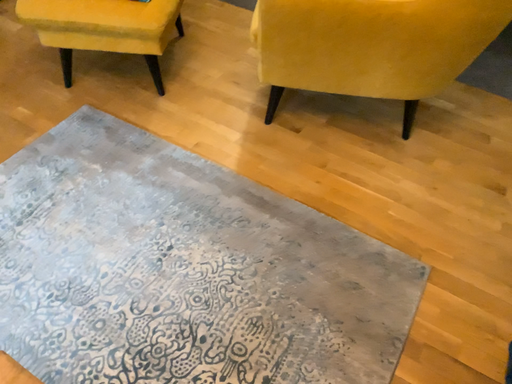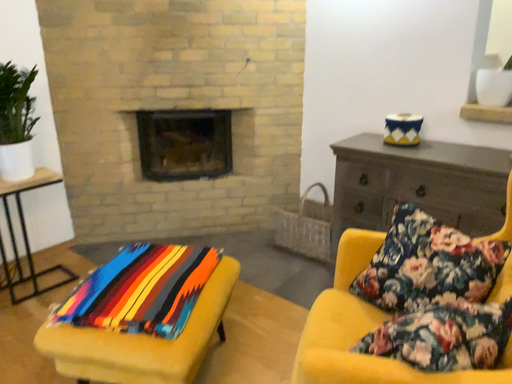
Question: Which way did the camera rotate in the video?

Choices:
 (A) rotated upward
 (B) rotated downward

Answer: (A)